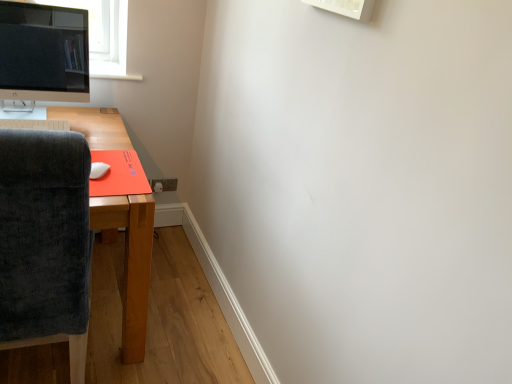
This screenshot has height=384, width=512. In order to click on free space to the right of white matte mouse at lower left in this screenshot , I will do `click(131, 178)`.